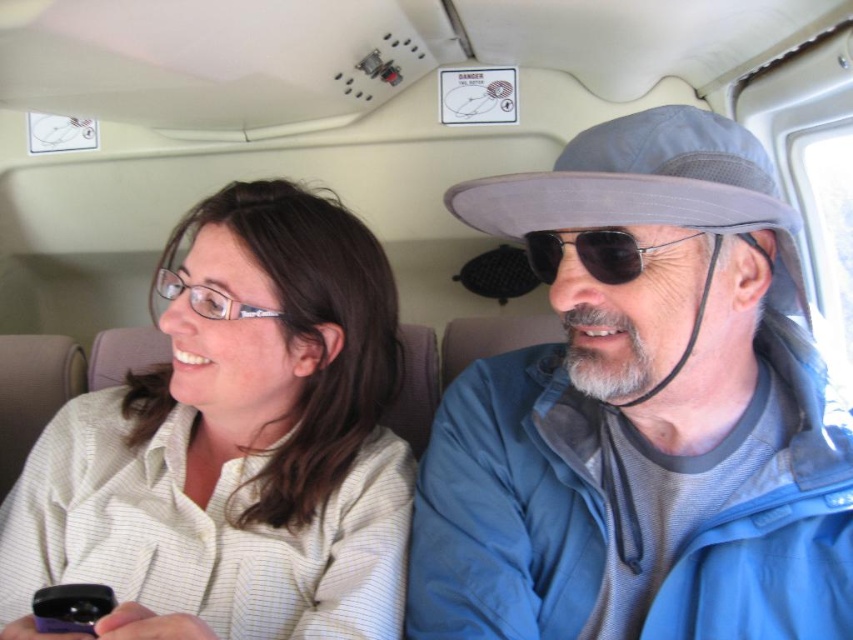
You are a passenger in the aircraft cabin and want to reach a point that is exactly at coordinates point [675,476]. If your arm can reach up to 70 centimeters, can you reach that point without moving your body?

The distance of point [675,476] from camera is 74.00 centimeters. Since your arm can only reach up to 70 centimeters, you cannot reach the point without moving your body.

You are a passenger in the aircraft cabin and want to reach the point marked as point (212,596) from the point marked as point (616,250). Based on the spatial relationship between these two points, which direction should you move relative to your current position?

You should move backward since point (212,596) is behind point (616,250).